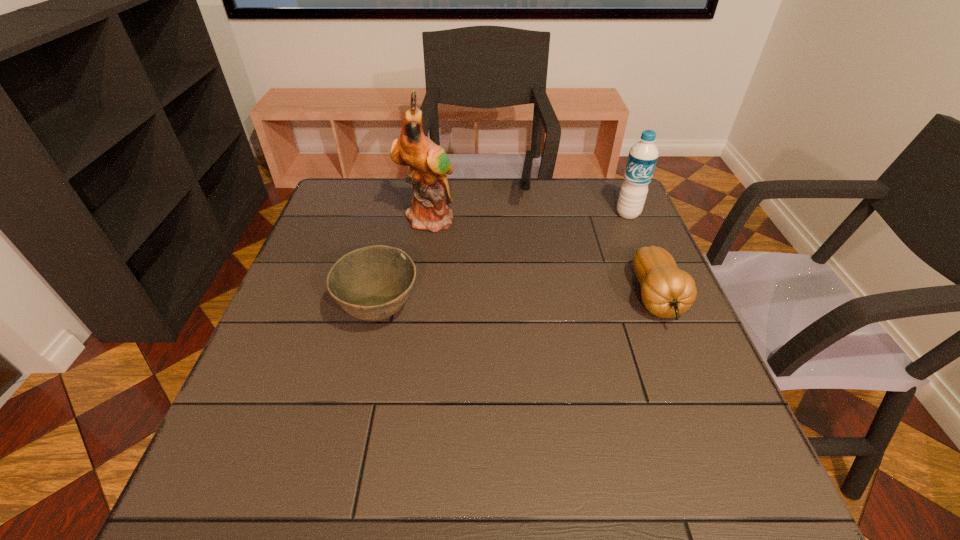
The height and width of the screenshot is (540, 960). Identify the location of free space that is in between the fourth shortest object and the bowl. (504, 263).

Locate an element on the screen. The height and width of the screenshot is (540, 960). empty location between the tallest object and the third object from left to right is located at coordinates (476, 208).

Where is `vacant space in between the bowl and the water bottle`? vacant space in between the bowl and the water bottle is located at coordinates (504, 263).

Find the location of a particular element. The width and height of the screenshot is (960, 540). free spot between the parrot and the pistol is located at coordinates (476, 208).

Find the location of a particular element. Image resolution: width=960 pixels, height=540 pixels. free space between the tallest object and the gourd is located at coordinates (541, 258).

Locate which object is the second closest to the fourth shortest object. Please provide its 2D coordinates. Your answer should be formatted as a tuple, i.e. [(x, y)], where the tuple contains the x and y coordinates of a point satisfying the conditions above.

[(525, 182)]

Select which object is the fourth closest to the bowl. Please provide its 2D coordinates. Your answer should be formatted as a tuple, i.e. [(x, y)], where the tuple contains the x and y coordinates of a point satisfying the conditions above.

[(643, 156)]

Find the location of a particular element. The width and height of the screenshot is (960, 540). vacant space that satisfies the following two spatial constraints: 1. on the back side of the fourth shortest object; 2. on the left side of the bowl is located at coordinates pyautogui.click(x=402, y=214).

Where is `vacant region that satisfies the following two spatial constraints: 1. on the back side of the pistol; 2. on the left side of the bowl`? Image resolution: width=960 pixels, height=540 pixels. vacant region that satisfies the following two spatial constraints: 1. on the back side of the pistol; 2. on the left side of the bowl is located at coordinates (405, 198).